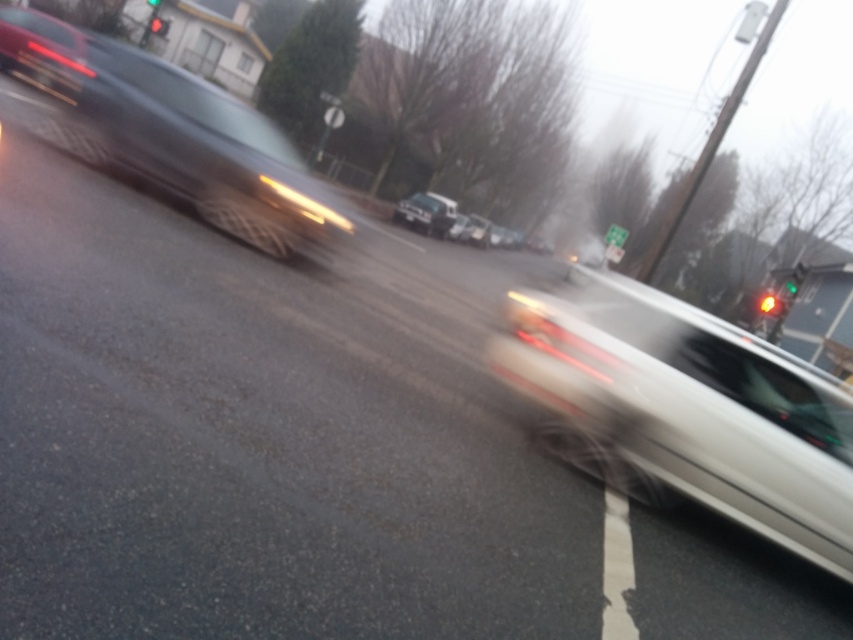
You are a pedestrian waiting at the crosswalk. You see the metallic silver car at left and the amber glass traffic light at center. Which object is closer to you?

The metallic silver car at left is positioned over the amber glass traffic light at center, which means it is closer to you.

You are a pedestrian standing at the crosswalk. You see the satin silver sedan at right and the green glass traffic light at upper right. Which object is taller?

The green glass traffic light at upper right is taller than the satin silver sedan at right.

You are a pedestrian standing at the crosswalk. You see a metallic silver car at left and an amber glass traffic light at center. Which object is taller?

The metallic silver car at left is taller than the amber glass traffic light at center.